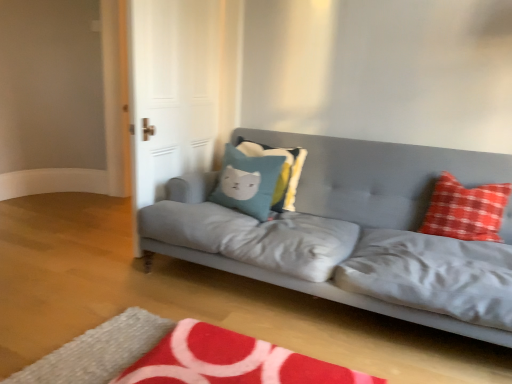
Question: Is teal fabric pillow with cat design at center, the first pillow positioned from the left, touching matte gray couch at center?

Choices:
 (A) no
 (B) yes

Answer: (A)

Question: Is teal fabric pillow with cat design at center, which appears as the third pillow when viewed from the right, positioned before matte gray couch at center?

Choices:
 (A) yes
 (B) no

Answer: (B)

Question: Can you confirm if teal fabric pillow with cat design at center, which appears as the third pillow when viewed from the right, is thinner than matte gray couch at center?

Choices:
 (A) no
 (B) yes

Answer: (B)

Question: From the image's perspective, does teal fabric pillow with cat design at center, which appears as the third pillow when viewed from the right, appear lower than matte gray couch at center?

Choices:
 (A) yes
 (B) no

Answer: (B)

Question: Can you confirm if teal fabric pillow with cat design at center, which appears as the third pillow when viewed from the right, is bigger than matte gray couch at center?

Choices:
 (A) yes
 (B) no

Answer: (B)

Question: From the image's perspective, is teal fabric pillow with cat design at center, which appears as the third pillow when viewed from the right, on matte gray couch at center?

Choices:
 (A) no
 (B) yes

Answer: (B)

Question: From a real-world perspective, is red plush rug at lower center beneath teal fabric pillow at center, which is the 2th pillow from left to right?

Choices:
 (A) no
 (B) yes

Answer: (B)

Question: Is red plush rug at lower center aimed at teal fabric pillow at center, which is the 2th pillow from left to right?

Choices:
 (A) no
 (B) yes

Answer: (A)

Question: Can you confirm if red plush rug at lower center is wider than teal fabric pillow at center, arranged as the second pillow when viewed from the right?

Choices:
 (A) yes
 (B) no

Answer: (A)

Question: Can you confirm if red plush rug at lower center is bigger than teal fabric pillow at center, arranged as the second pillow when viewed from the right?

Choices:
 (A) yes
 (B) no

Answer: (A)

Question: Does red plush rug at lower center appear on the left side of teal fabric pillow at center, which is the 2th pillow from left to right?

Choices:
 (A) no
 (B) yes

Answer: (B)

Question: Considering the relative positions of red plush rug at lower center and teal fabric pillow at center, which is the 2th pillow from left to right, in the image provided, is red plush rug at lower center to the right of teal fabric pillow at center, which is the 2th pillow from left to right, from the viewer's perspective?

Choices:
 (A) no
 (B) yes

Answer: (A)

Question: Are white glossy door at upper left and matte gray couch at center far apart?

Choices:
 (A) yes
 (B) no

Answer: (B)